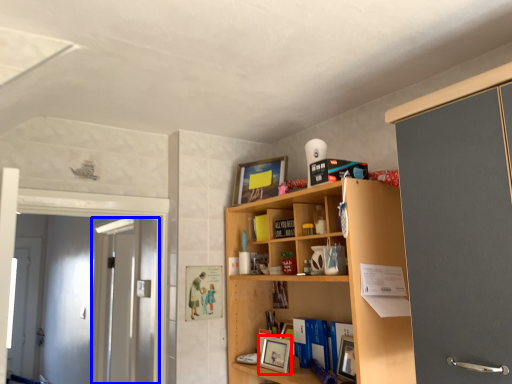
Question: Among these objects, which one is farthest to the camera, picture frame (highlighted by a red box) or screen door (highlighted by a blue box)?

Choices:
 (A) picture frame
 (B) screen door

Answer: (B)